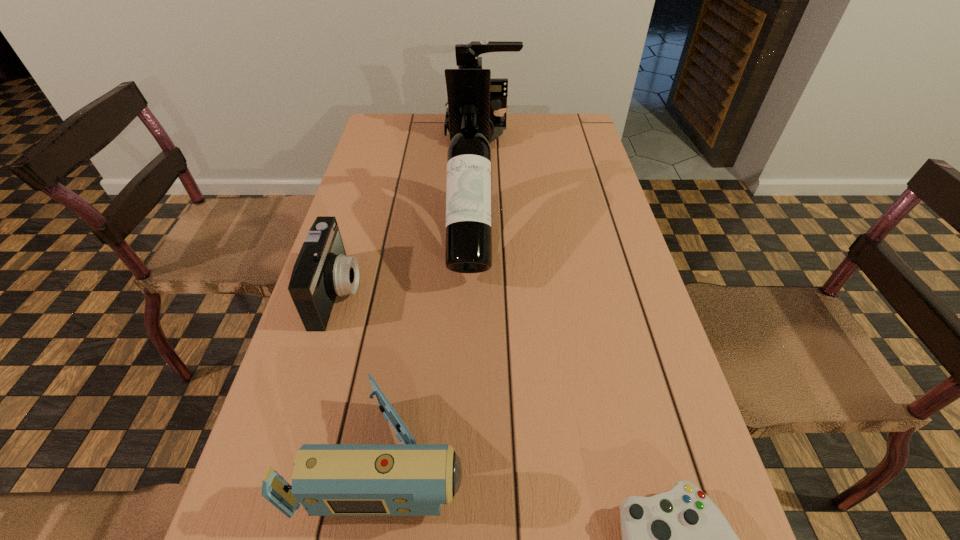
You are a GUI agent. You are given a task and a screenshot of the screen. Output one action in this format:
    pyautogui.click(x=<x>, y=<y>)
    Task: Click on the vacant space located on the lens of the second farthest camcorder
    The image size is (960, 540).
    Given the screenshot: What is the action you would take?
    pyautogui.click(x=461, y=292)

At what (x,y) coordinates should I click in order to perform the action: click on object present at the far edge. Please return your answer as a coordinate pair (x, y). The height and width of the screenshot is (540, 960). Looking at the image, I should click on (467, 55).

You are a GUI agent. You are given a task and a screenshot of the screen. Output one action in this format:
    pyautogui.click(x=<x>, y=<y>)
    Task: Click on the vacant space at the far edge of the desktop
    
    Given the screenshot: What is the action you would take?
    pyautogui.click(x=440, y=147)

Image resolution: width=960 pixels, height=540 pixels. I want to click on vacant area at the left edge of the desktop, so (x=345, y=367).

Where is `free space at the right edge`? Image resolution: width=960 pixels, height=540 pixels. free space at the right edge is located at coordinates (642, 281).

Where is `free space at the far left corner`? This screenshot has height=540, width=960. free space at the far left corner is located at coordinates (381, 116).

Where is `vacant space at the far right corner`? The image size is (960, 540). vacant space at the far right corner is located at coordinates (567, 147).

Locate an element on the screen. The height and width of the screenshot is (540, 960). free space between the second farthest camcorder and the tallest camcorder is located at coordinates (409, 213).

The width and height of the screenshot is (960, 540). In order to click on free spot between the nearest camcorder and the farthest camcorder in this screenshot , I will do `click(433, 295)`.

Where is `unoccupied area between the second farthest camcorder and the wine bottle`? The width and height of the screenshot is (960, 540). unoccupied area between the second farthest camcorder and the wine bottle is located at coordinates (404, 264).